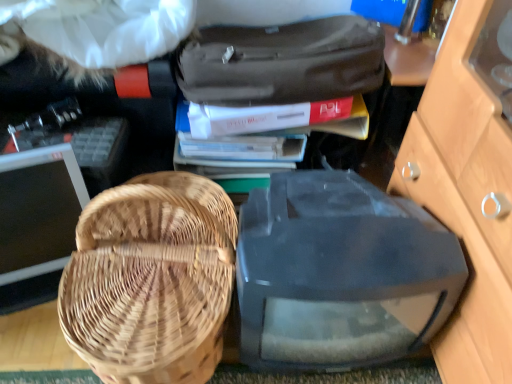
Question: Does matte black suitcase at upper center have a greater width compared to matte black monitor at left, the 1th computer monitor when ordered from left to right?

Choices:
 (A) yes
 (B) no

Answer: (A)

Question: From a real-world perspective, is matte black suitcase at upper center over matte black monitor at left, the 1th computer monitor when ordered from left to right?

Choices:
 (A) no
 (B) yes

Answer: (B)

Question: Can you confirm if matte black suitcase at upper center is shorter than matte black monitor at left, the 1th computer monitor when ordered from left to right?

Choices:
 (A) no
 (B) yes

Answer: (B)

Question: From a real-world perspective, is matte black suitcase at upper center beneath matte black monitor at left, the 1th computer monitor when ordered from left to right?

Choices:
 (A) yes
 (B) no

Answer: (B)

Question: Are matte black suitcase at upper center and matte black monitor at left, the 1th computer monitor when ordered from left to right, located far from each other?

Choices:
 (A) yes
 (B) no

Answer: (B)

Question: From their relative heights in the image, would you say matte black suitcase at upper center is taller or shorter than matte black monitor at left, the 1th computer monitor when ordered from left to right?

Choices:
 (A) tall
 (B) short

Answer: (B)

Question: Looking at their shapes, would you say matte black suitcase at upper center is wider or thinner than matte black monitor at left, the 2th computer monitor viewed from the right?

Choices:
 (A) thin
 (B) wide

Answer: (B)

Question: Would you say matte black suitcase at upper center is inside or outside matte black monitor at left, the 1th computer monitor when ordered from left to right?

Choices:
 (A) outside
 (B) inside

Answer: (A)

Question: Is matte black suitcase at upper center bigger or smaller than matte black monitor at left, the 2th computer monitor viewed from the right?

Choices:
 (A) big
 (B) small

Answer: (A)

Question: Is white paper book at center, marked as the second book in a top-to-bottom arrangement, situated inside transparent plastic computer monitor at center, the second computer monitor viewed from the left, or outside?

Choices:
 (A) outside
 (B) inside

Answer: (A)

Question: Is point (223, 155) closer or farther from the camera than point (300, 279)?

Choices:
 (A) farther
 (B) closer

Answer: (A)

Question: From the image's perspective, relative to transparent plastic computer monitor at center, the second computer monitor viewed from the left, is white paper book at center, marked as the second book in a top-to-bottom arrangement, above or below?

Choices:
 (A) below
 (B) above

Answer: (B)

Question: From a real-world perspective, is white paper book at center, which is the 1th book in bottom-to-top order, above or below transparent plastic computer monitor at center, the 1th computer monitor positioned from the right?

Choices:
 (A) above
 (B) below

Answer: (A)

Question: From the image's perspective, relative to transparent plastic computer monitor at center, the 1th computer monitor positioned from the right, is matte black monitor at left, the 1th computer monitor when ordered from left to right, above or below?

Choices:
 (A) above
 (B) below

Answer: (A)

Question: From their relative heights in the image, would you say matte black monitor at left, the 2th computer monitor viewed from the right, is taller or shorter than transparent plastic computer monitor at center, the second computer monitor viewed from the left?

Choices:
 (A) tall
 (B) short

Answer: (A)